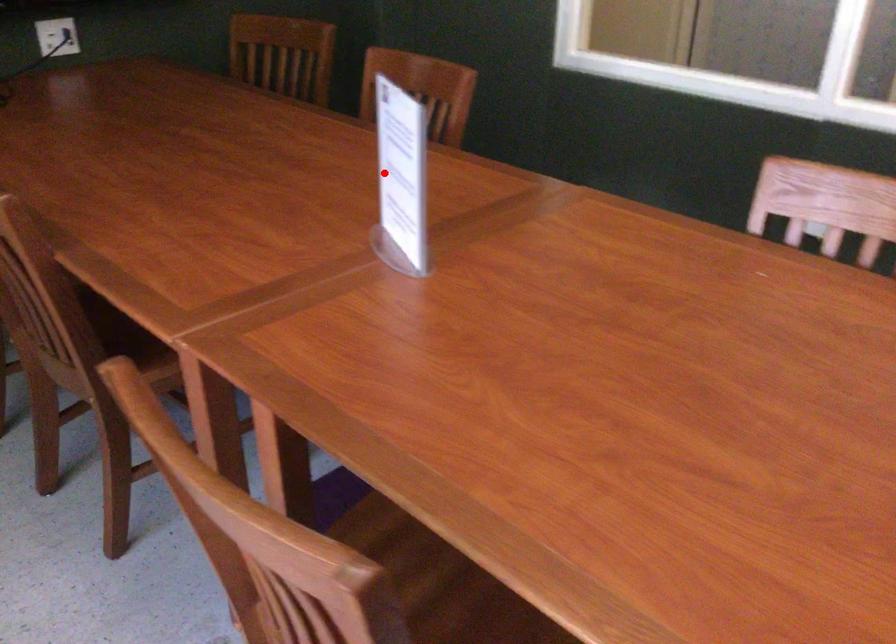
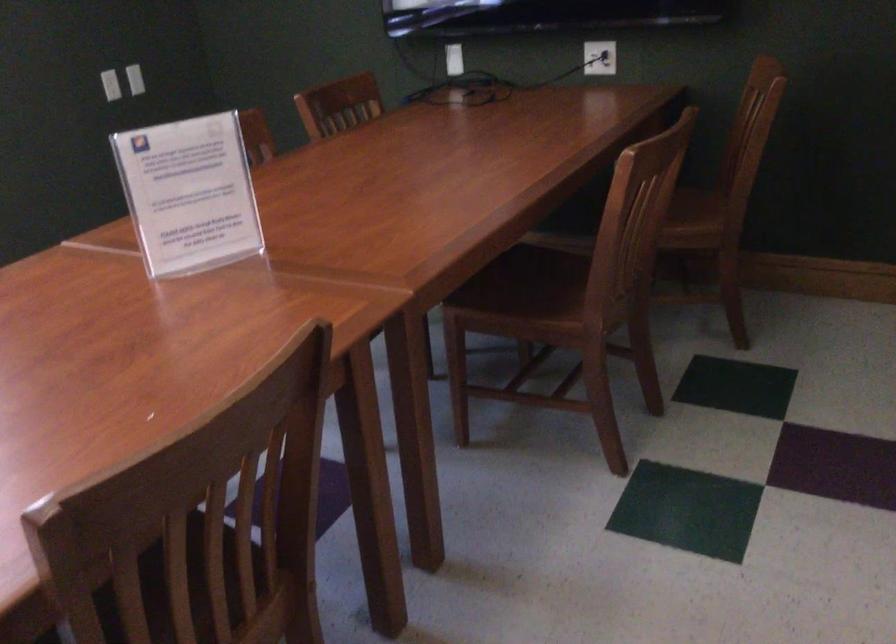
Question: I am providing you with two images of the same scene from different viewpoints. In image1, a red point is highlighted. Considering the same 3D point in image2, which of the following is correct?

Choices:
 (A) It is closer
 (B) It is farther

Answer: (B)